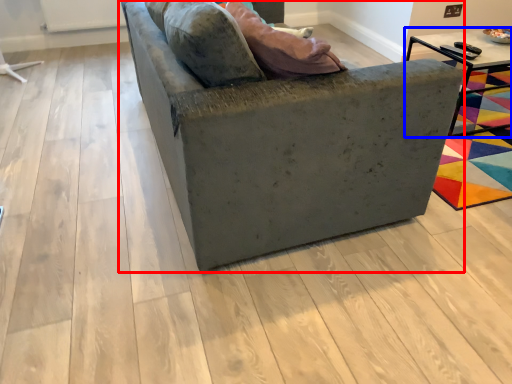
Question: Which object is further to the camera taking this photo, studio couch (highlighted by a red box) or table (highlighted by a blue box)?

Choices:
 (A) studio couch
 (B) table

Answer: (B)